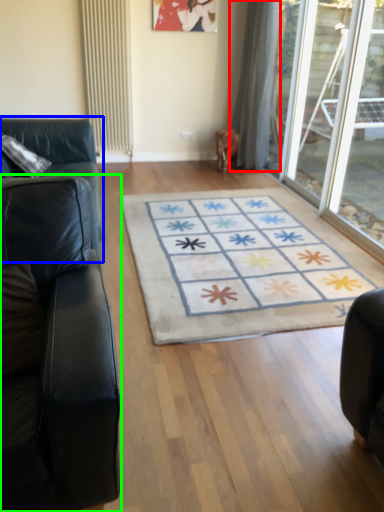
Question: Considering the real-world distances, which object is closest to curtain (highlighted by a red box)? studio couch (highlighted by a blue box) or studio couch (highlighted by a green box).

Choices:
 (A) studio couch
 (B) studio couch

Answer: (A)